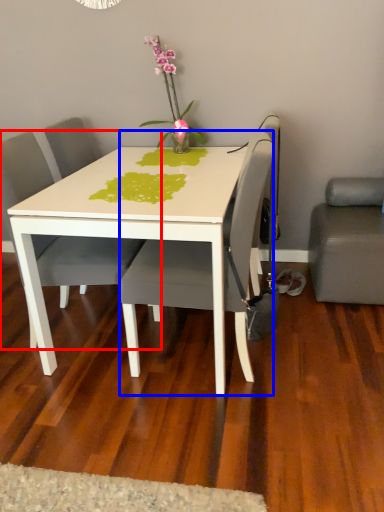
Question: Which of the following is the farthest to the observer, chair (highlighted by a red box) or chair (highlighted by a blue box)?

Choices:
 (A) chair
 (B) chair

Answer: (A)